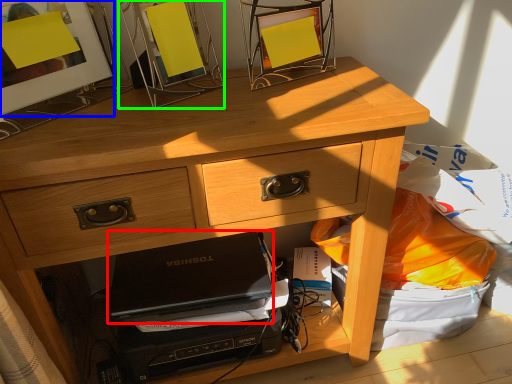
Question: Estimate the real-world distances between objects in this image. Which object is closer to laptop (highlighted by a red box), picture frame (highlighted by a blue box) or picture frame (highlighted by a green box)?

Choices:
 (A) picture frame
 (B) picture frame

Answer: (B)